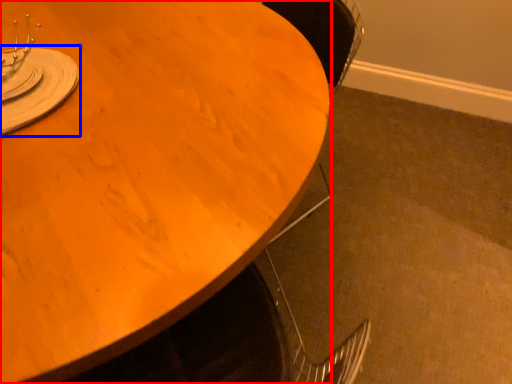
Question: Which of the following is the closest to the observer, table (highlighted by a red box) or tableware (highlighted by a blue box)?

Choices:
 (A) table
 (B) tableware

Answer: (A)